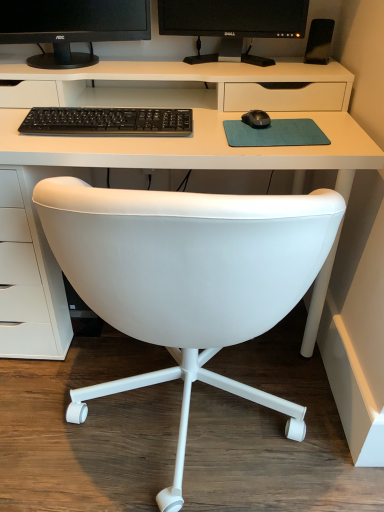
Identify the location of free space to the left of black matte speaker at upper right. The height and width of the screenshot is (512, 384). (286, 62).